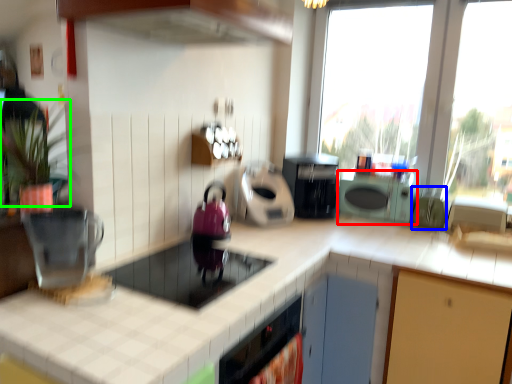
Question: Considering the real-world distances, which object is closest to cabinetry (highlighted by a red box)? appliance (highlighted by a blue box) or plant (highlighted by a green box).

Choices:
 (A) appliance
 (B) plant

Answer: (A)